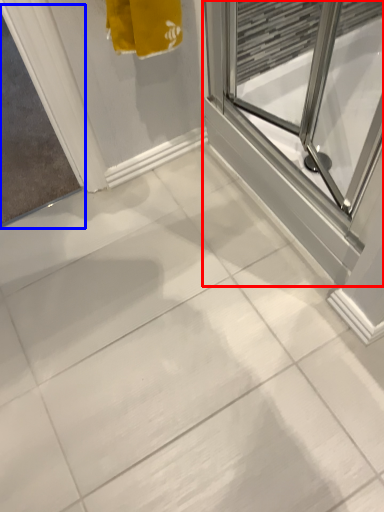
Question: Which point is further to the camera, screen door (highlighted by a red box) or window screen (highlighted by a blue box)?

Choices:
 (A) screen door
 (B) window screen

Answer: (B)